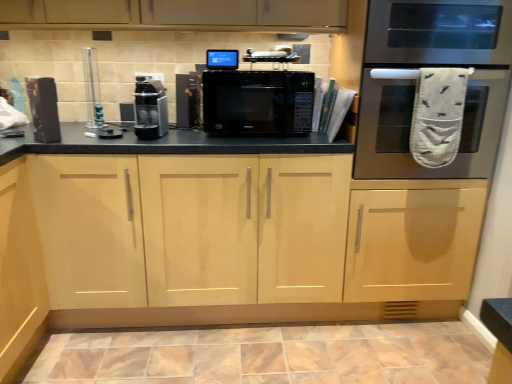
In order to click on vacant area located to the right-hand side of satin black coffee machine at center, the third appliance from the right in this screenshot , I will do `click(183, 139)`.